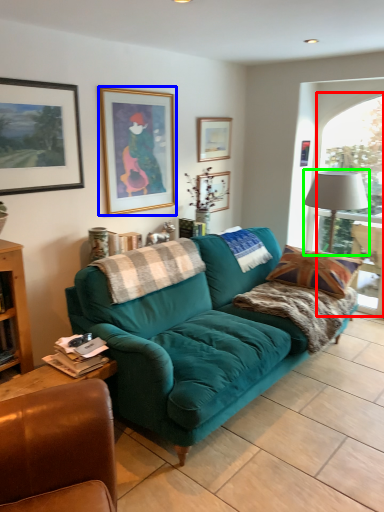
Question: Estimate the real-world distances between objects in this image. Which object is closer to window (highlighted by a red box), picture frame (highlighted by a blue box) or lamp (highlighted by a green box)?

Choices:
 (A) picture frame
 (B) lamp

Answer: (B)